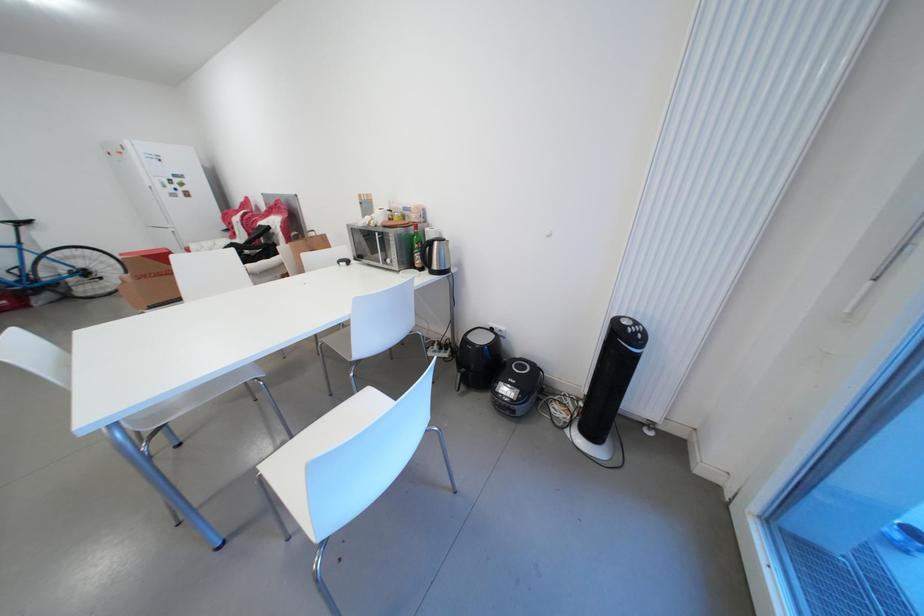
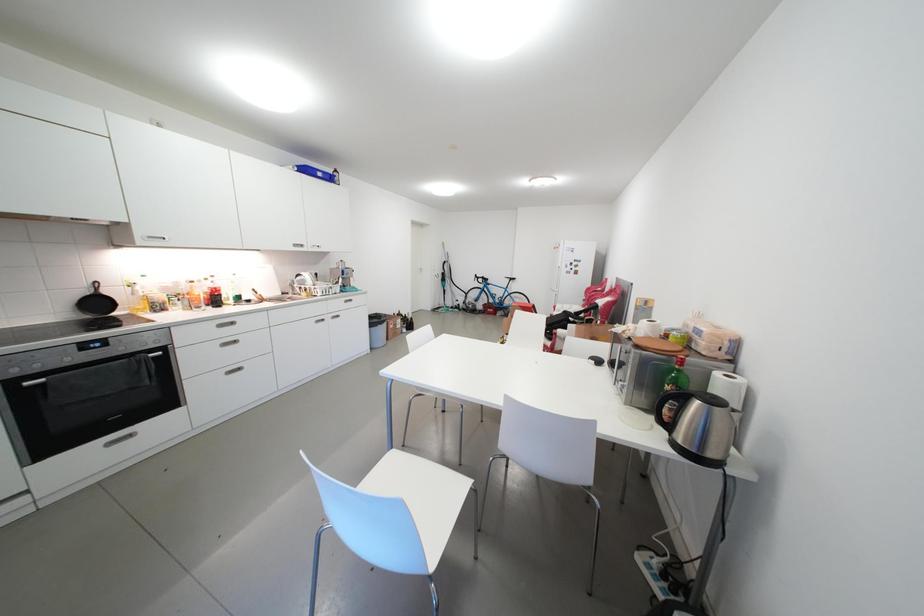
Question: The first image is from the beginning of the video and the second image is from the end. How did the camera likely rotate when shooting the video?

Choices:
 (A) Left
 (B) Right
 (C) Up
 (D) Down

Answer: (A)